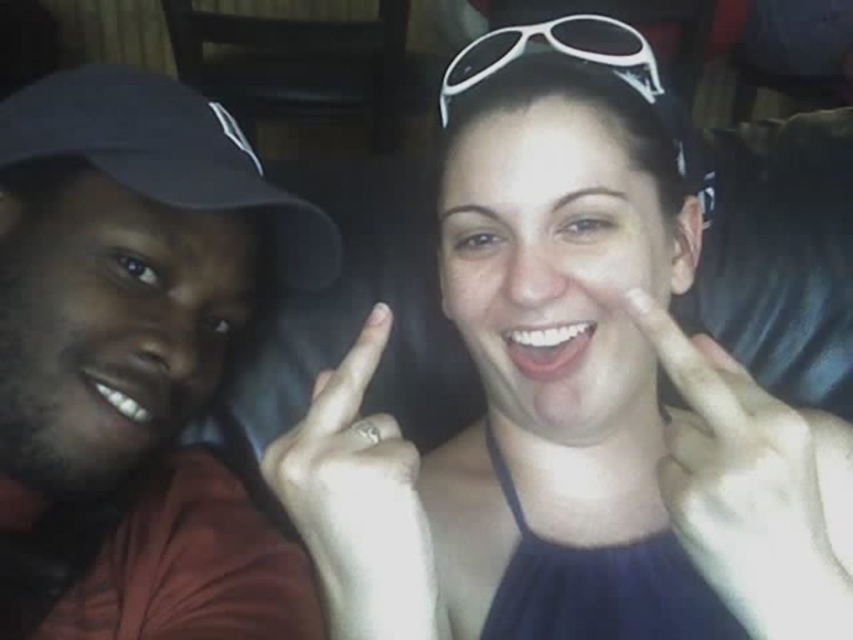
You are standing in front of the two people in the image. If you want to touch the point at coordinates point (x=331, y=378) and point (x=172, y=177), which one would you reach first?

Point (x=331, y=378) is in front of point (x=172, y=177), so you would reach point (x=331, y=378) first.

You are a photographer trying to capture the exact position of the black fabric baseball cap at left in the image. The coordinates given are point (166, 154). If the image has a width of 1000 pixels and height of 1500 pixels, what are the pixel coordinates of the black fabric baseball cap at left?

The pixel coordinates of the black fabric baseball cap at left are calculated by multiplying the width and height by the given coordinates. The x coordinate is 0.242 multiplied by 1000 pixels, resulting in 242 pixels. The y coordinate is 0.196 multiplied by 1500 pixels, resulting in 294 pixels. Therefore, the pixel coordinates are approximately 242, 294.